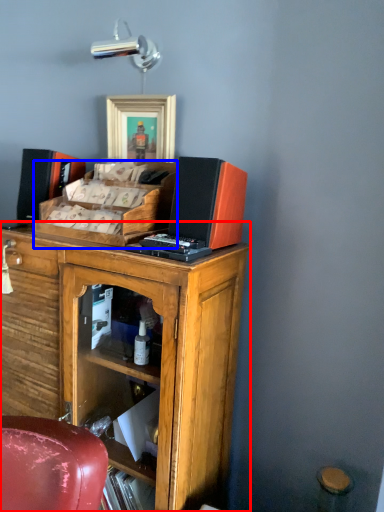
Question: Which object appears closest to the camera in this image, cabinetry (highlighted by a red box) or desk (highlighted by a blue box)?

Choices:
 (A) cabinetry
 (B) desk

Answer: (A)